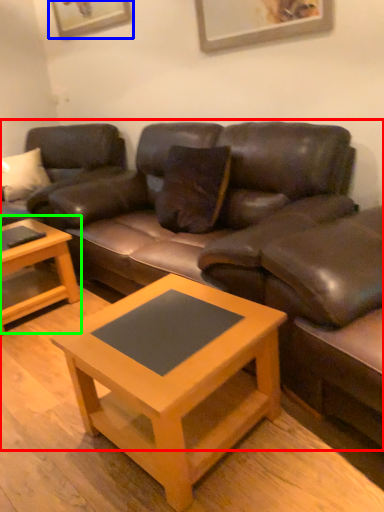
Question: Which is farther away from studio couch (highlighted by a red box)? picture frame (highlighted by a blue box) or coffee table (highlighted by a green box)?

Choices:
 (A) picture frame
 (B) coffee table

Answer: (A)